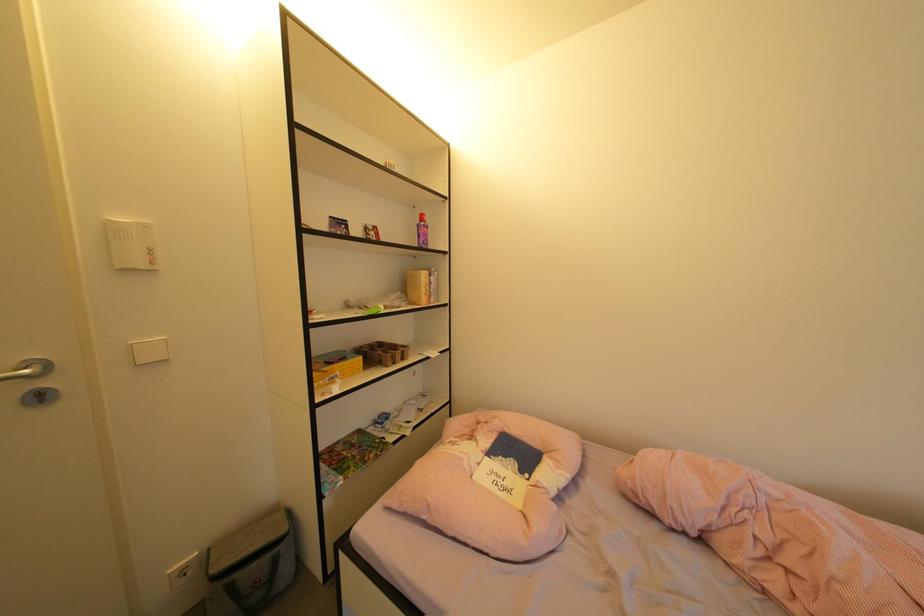
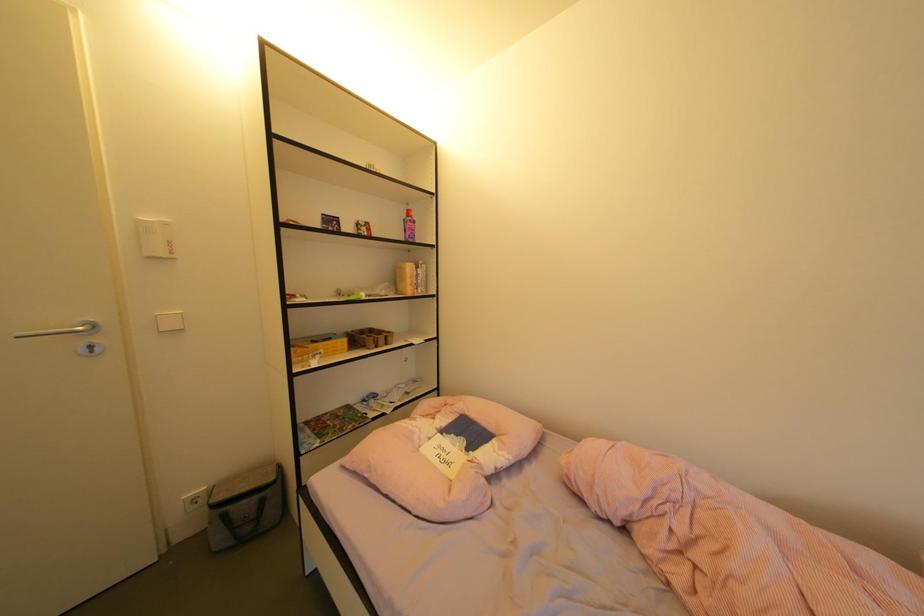
Question: The images are taken continuously from a first-person perspective. In which direction is your viewpoint rotating?

Choices:
 (A) Left
 (B) Right
 (C) Up
 (D) Down

Answer: (A)